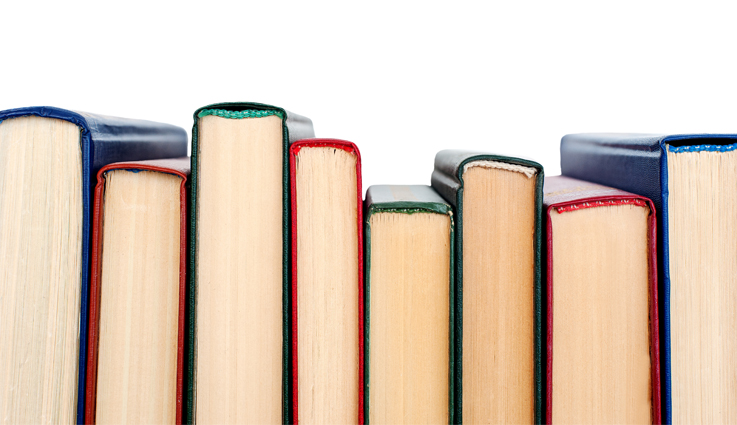
The height and width of the screenshot is (425, 737). I want to click on books, so click(49, 248), click(125, 272), click(214, 263), click(326, 277), click(410, 291), click(494, 291), click(576, 302), click(677, 263).